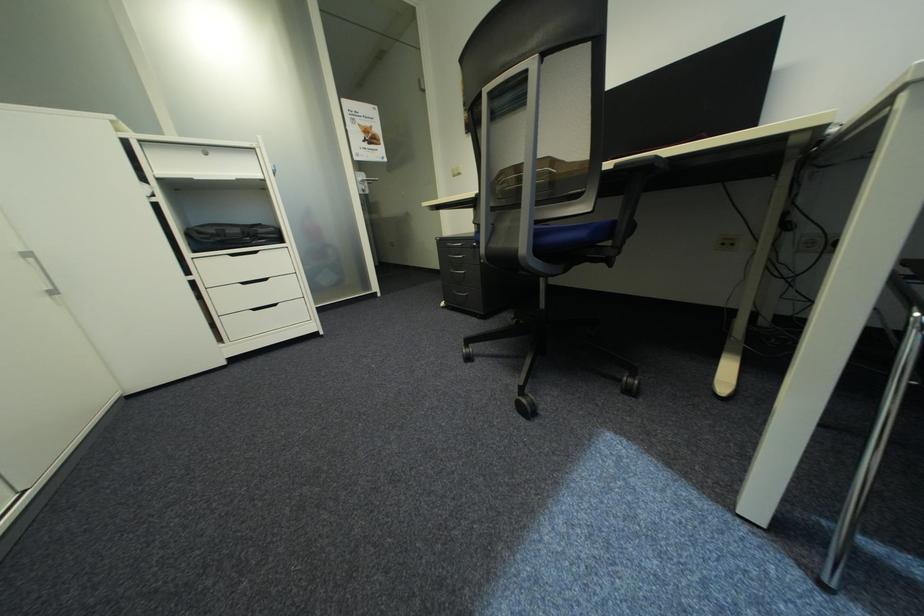
Find where to sit the blue chair sitting surface. Please return your answer as a coordinate pair (x, y).

(584, 232)